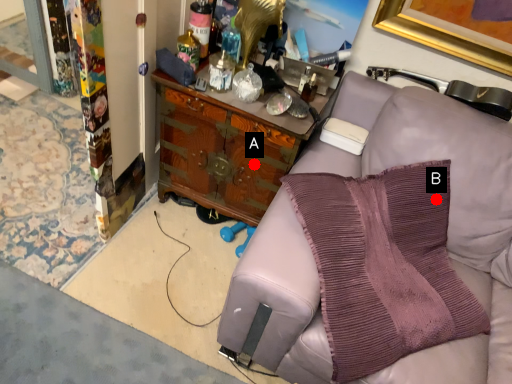
Question: Two points are circled on the image, labeled by A and B beside each circle. Which point is closer to the camera taking this photo?

Choices:
 (A) A is closer
 (B) B is closer

Answer: (B)